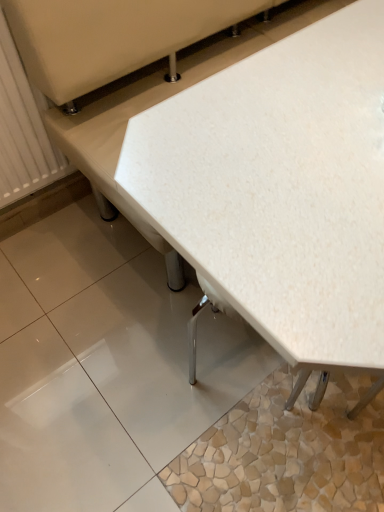
What do you see at coordinates (281, 190) in the screenshot?
I see `white speckled plastic table at center` at bounding box center [281, 190].

Looking at this image, what is the approximate height of white speckled plastic table at center?

white speckled plastic table at center is 30.50 inches tall.

The height and width of the screenshot is (512, 384). I want to click on white speckled plastic table at center, so click(x=281, y=190).

Locate an element on the screen. white speckled plastic table at center is located at coordinates (281, 190).